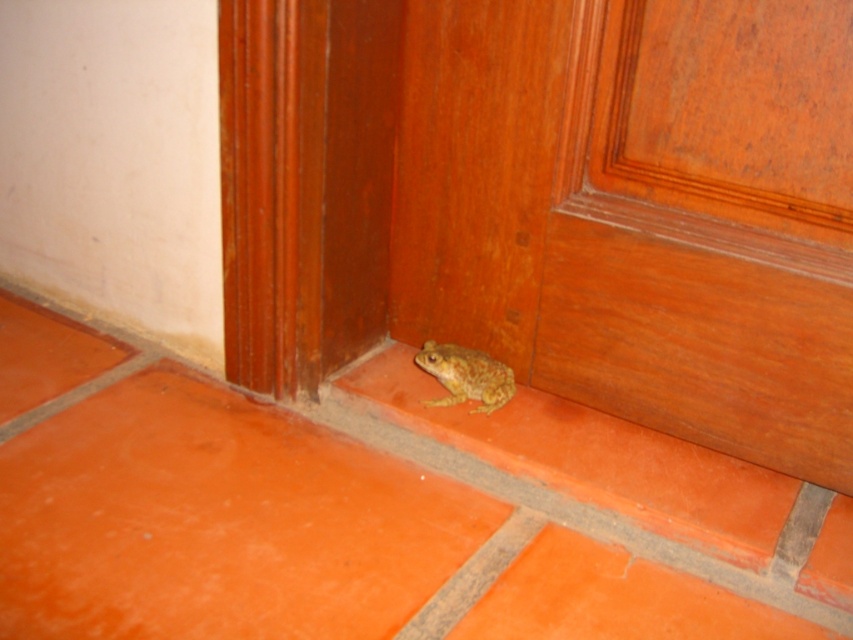
Question: Which object is farther from the camera taking this photo?

Choices:
 (A) wooden door at lower right
 (B) camouflage skin frog at lower right

Answer: (B)

Question: Does wooden door at lower right appear on the right side of camouflage skin frog at lower right?

Choices:
 (A) no
 (B) yes

Answer: (B)

Question: Which point appears closest to the camera in this image?

Choices:
 (A) [448, 380]
 (B) [698, 276]

Answer: (B)

Question: Is wooden door at lower right to the right of camouflage skin frog at lower right from the viewer's perspective?

Choices:
 (A) yes
 (B) no

Answer: (A)

Question: Is wooden door at lower right wider than camouflage skin frog at lower right?

Choices:
 (A) yes
 (B) no

Answer: (A)